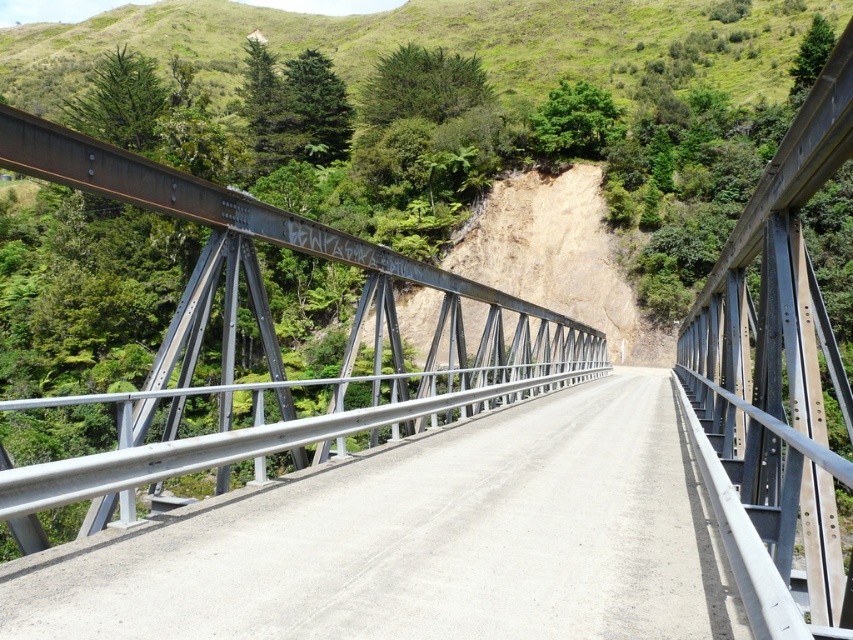
Question: Which of the following is the farthest from the observer?

Choices:
 (A) green grassy hillside at upper center
 (B) metallic gray bridge at center

Answer: (A)

Question: Which of these objects is positioned closest to the smooth concrete road at center?

Choices:
 (A) green grassy hillside at upper center
 (B) metallic gray bridge at center

Answer: (B)

Question: Is smooth concrete road at center to the right of green grassy hillside at upper center from the viewer's perspective?

Choices:
 (A) yes
 (B) no

Answer: (A)

Question: Does metallic gray bridge at center appear over green grassy hillside at upper center?

Choices:
 (A) yes
 (B) no

Answer: (B)

Question: Which is farther from the metallic gray bridge at center?

Choices:
 (A) green grassy hillside at upper center
 (B) smooth concrete road at center

Answer: (A)

Question: Observing the image, what is the correct spatial positioning of smooth concrete road at center in reference to green grassy hillside at upper center?

Choices:
 (A) below
 (B) above

Answer: (A)